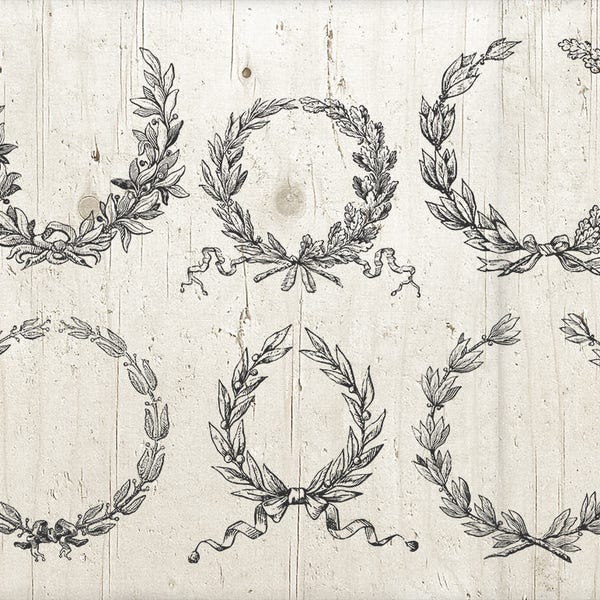
Locate an element on the screen. Image resolution: width=600 pixels, height=600 pixels. flower petals on far right wreath is located at coordinates (436, 435), (441, 394), (461, 360), (504, 332), (460, 499), (488, 515), (519, 525), (559, 525), (590, 508), (579, 330).